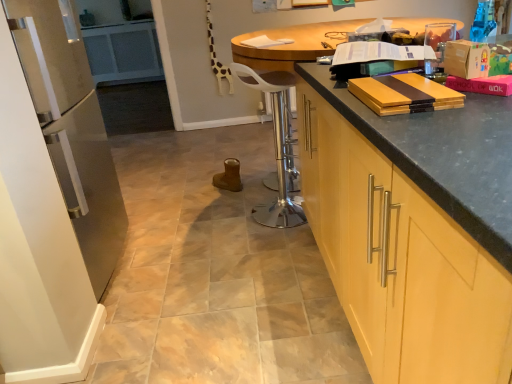
Question: From a real-world perspective, is matte yellow wood book at upper right, the 3th book in the bottom-to-top sequence, physically below white glossy refrigerator at left?

Choices:
 (A) yes
 (B) no

Answer: (B)

Question: Is matte yellow wood book at upper right, the 3th book in the bottom-to-top sequence, looking in the opposite direction of white glossy refrigerator at left?

Choices:
 (A) no
 (B) yes

Answer: (B)

Question: Considering the relative sizes of matte yellow wood book at upper right, which ranks as the 2th book in top-to-bottom order, and white glossy refrigerator at left in the image provided, is matte yellow wood book at upper right, which ranks as the 2th book in top-to-bottom order, thinner than white glossy refrigerator at left?

Choices:
 (A) yes
 (B) no

Answer: (A)

Question: Could you tell me if matte yellow wood book at upper right, arranged as the 3th book when viewed from the front, is turned towards white glossy refrigerator at left?

Choices:
 (A) yes
 (B) no

Answer: (B)

Question: Does matte yellow wood book at upper right, which appears as the 2th book when viewed from the back, appear on the left side of white glossy refrigerator at left?

Choices:
 (A) yes
 (B) no

Answer: (B)

Question: Is matte cardboard book at upper right, the second book positioned from the front, spatially inside metallic silver bar stool at center, or outside of it?

Choices:
 (A) outside
 (B) inside

Answer: (A)

Question: Relative to metallic silver bar stool at center, is matte cardboard book at upper right, the 2th book positioned from the bottom, in front or behind?

Choices:
 (A) front
 (B) behind

Answer: (A)

Question: From the image's perspective, is matte cardboard book at upper right, the third book viewed from the top, located above or below metallic silver bar stool at center?

Choices:
 (A) below
 (B) above

Answer: (B)

Question: Based on their sizes in the image, would you say matte cardboard book at upper right, the third book in the back-to-front sequence, is bigger or smaller than metallic silver bar stool at center?

Choices:
 (A) small
 (B) big

Answer: (A)

Question: Relative to yellow wood cutting board at upper right, which is the first book from bottom to top, is metallic silver bar stool at center in front or behind?

Choices:
 (A) front
 (B) behind

Answer: (B)

Question: From a real-world perspective, relative to yellow wood cutting board at upper right, marked as the 4th book in a top-to-bottom arrangement, is metallic silver bar stool at center vertically above or below?

Choices:
 (A) below
 (B) above

Answer: (A)

Question: Looking at the image, does metallic silver bar stool at center seem bigger or smaller compared to yellow wood cutting board at upper right, the fourth book from the back?

Choices:
 (A) big
 (B) small

Answer: (A)

Question: From their relative heights in the image, would you say metallic silver bar stool at center is taller or shorter than yellow wood cutting board at upper right, which is the first book from bottom to top?

Choices:
 (A) tall
 (B) short

Answer: (A)

Question: Is matte yellow wood book at upper right, which appears as the 2th book when viewed from the back, bigger or smaller than white paper at center, the fourth book from the bottom?

Choices:
 (A) big
 (B) small

Answer: (A)

Question: In terms of width, does matte yellow wood book at upper right, which appears as the 2th book when viewed from the back, look wider or thinner when compared to white paper at center, the fourth book viewed from the front?

Choices:
 (A) thin
 (B) wide

Answer: (B)